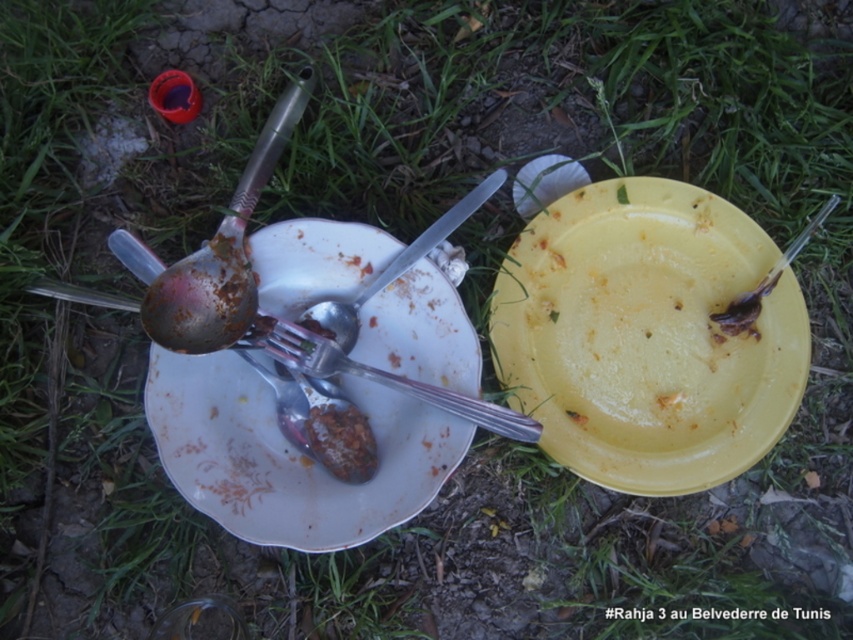
Does point (704, 337) come closer to viewer compared to point (184, 397)?

No.

Who is taller, yellow plastic plate at center or white porcelain plate at center?

With more height is yellow plastic plate at center.

Describe the element at coordinates (647, 337) in the screenshot. I see `yellow plastic plate at center` at that location.

You are a GUI agent. You are given a task and a screenshot of the screen. Output one action in this format:
    pyautogui.click(x=<x>, y=<y>)
    Task: Click on the yellow plastic plate at center
    This screenshot has width=853, height=640.
    Given the screenshot: What is the action you would take?
    pyautogui.click(x=647, y=337)

Between brown matte food at center and metallic spoon at right, which one is positioned lower?

brown matte food at center

Does brown matte food at center appear over metallic spoon at right?

Incorrect, brown matte food at center is not positioned above metallic spoon at right.

Is point (310, 448) more distant than point (724, 310)?

No, it is not.

Where is `brown matte food at center`? The width and height of the screenshot is (853, 640). brown matte food at center is located at coordinates (341, 440).

Does silver metallic fork at center have a greater height compared to brown matte food at center?

Indeed, silver metallic fork at center has a greater height compared to brown matte food at center.

Is point (257, 332) positioned before point (352, 483)?

Yes.

Identify the location of silver metallic fork at center. (378, 376).